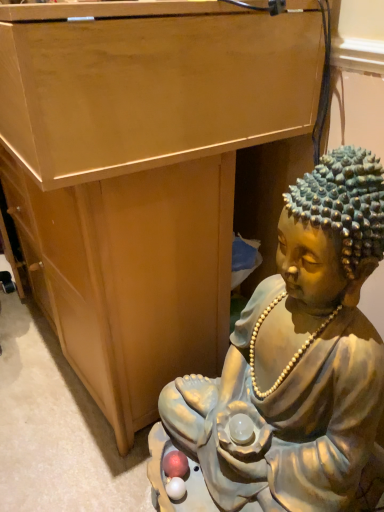
This screenshot has width=384, height=512. Describe the element at coordinates (298, 358) in the screenshot. I see `matte gold statue at lower right` at that location.

Measure the distance between matte gold statue at lower right and camera.

The distance of matte gold statue at lower right from camera is 24.00 inches.

The height and width of the screenshot is (512, 384). Identify the location of matte gold statue at lower right. (298, 358).

Where is `matte gold statue at lower right`? Image resolution: width=384 pixels, height=512 pixels. matte gold statue at lower right is located at coordinates (298, 358).